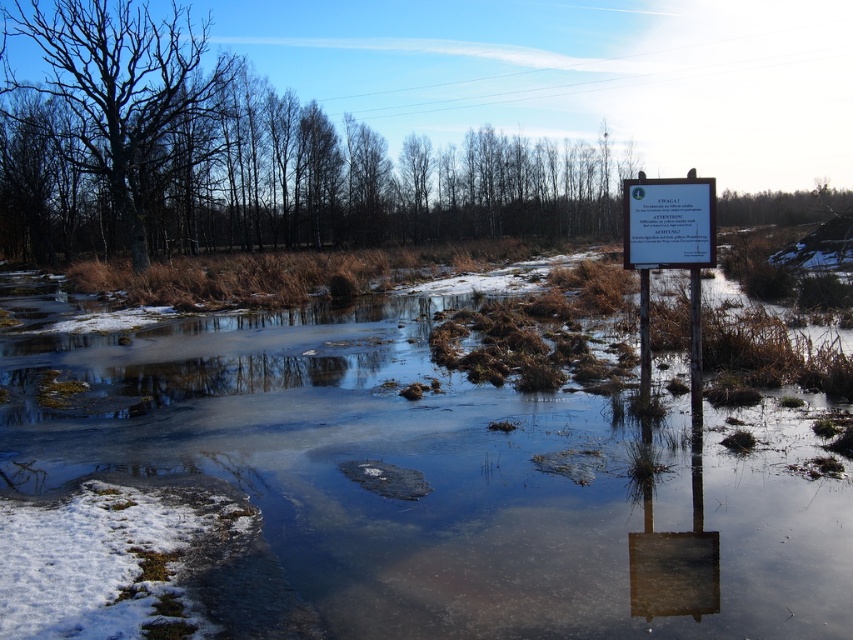
You are an environmental scientist assessing the health of the wetland. You observe the dark brown bark tree at left and the bare wood tree at upper center. Which tree might indicate a healthier state based on their sizes?

The bare wood tree at upper center is larger than the dark brown bark tree at left, suggesting it might be healthier as larger trees often indicate better growth conditions in wetlands.

You are standing at the center of the image and want to place a new sign exactly 0.2 units to the left of the white plastic sign at right. What coordinate would you use for the x position?

The white plastic sign at right is located at x coordinate 0.397. To place a new sign 0.2 units to the left, subtract 0.2 from 0.397, resulting in an x coordinate of 0.197.